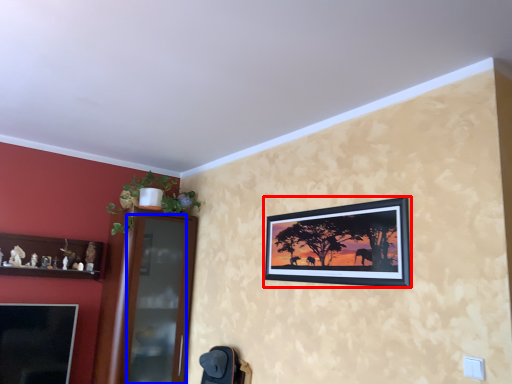
Question: Which object appears closest to the camera in this image, picture frame (highlighted by a red box) or glass door (highlighted by a blue box)?

Choices:
 (A) picture frame
 (B) glass door

Answer: (A)